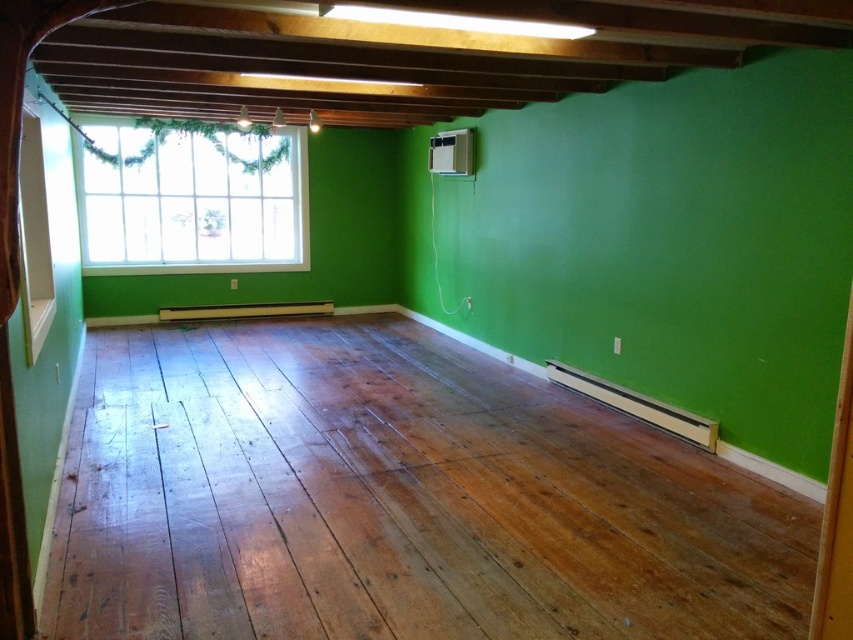
You are standing in the room and want to walk towards the shiny brown wood floor at center. Based on its 2D coordinates, in which direction should you move relative to your current position at point 0,0?

Since the shiny brown wood floor at center is located at point (395,500), you should move towards the right and slightly forward to reach it from your current position at (0,0).

You are standing in the room and want to move from the point at coordinates point (403,333) to the point at coordinates point (292,268). Since the room is empty except for the green walls and wooden floor, can you walk directly between these two points without any obstacles?

Yes, you can walk directly between point (403,333) and point (292,268) because the room is described as empty except for the green walls and wooden floor, so there are no obstacles blocking the path between them.